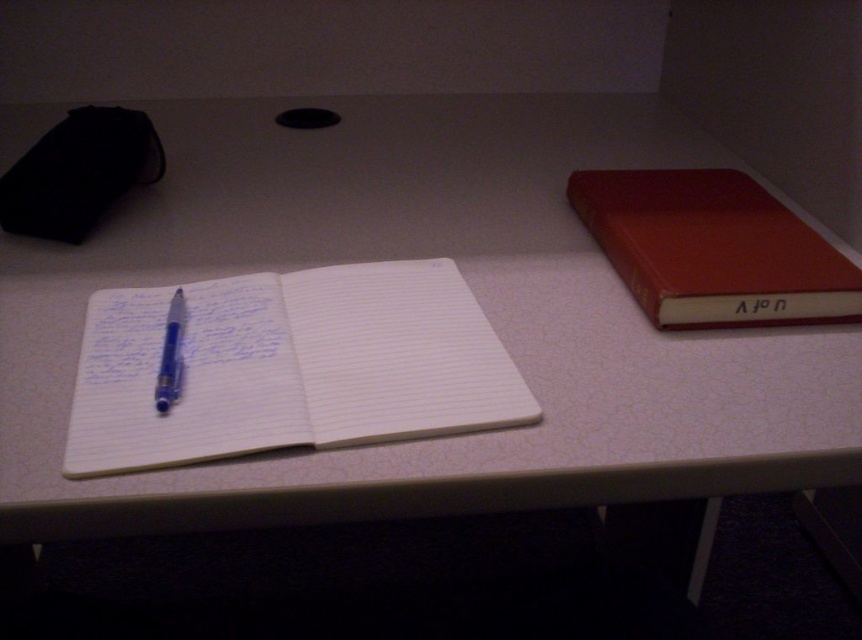
You are organizing your desk and need to place both the white lined paper at center and the red leather book at right into a drawer. The drawer has a height limit of 2 inches. Which item is more likely to fit based on their sizes?

The red leather book at right is smaller in size compared to the white lined paper at center, so it is more likely to fit into the drawer with a 2 inch height limit.

You need to place a new item between the white lined paper at center and the red leather book at right. Where should you place it?

You should place the new item between the white lined paper at center and the red leather book at right, to the right of the white lined paper at center and to the left of the red leather book at right since the white lined paper at center is to the left of the red leather book at right.

You need to write a letter on the desk and have both the white lined paper at center and the blue glossy pen at center available. Which object should you use to write on the other?

You should use the blue glossy pen at center to write on the white lined paper at center since the pen is for writing and the paper is for being written on.